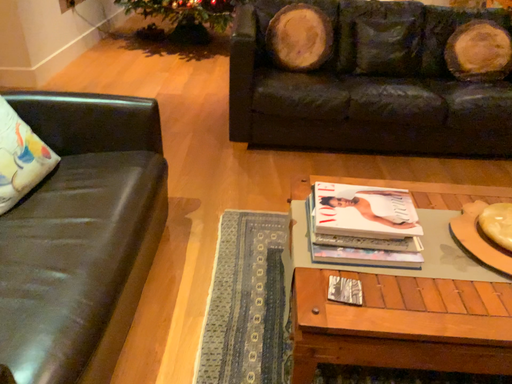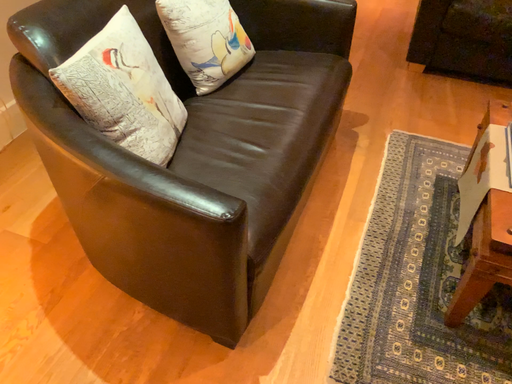
Question: How did the camera likely rotate when shooting the video?

Choices:
 (A) rotated left
 (B) rotated right

Answer: (A)